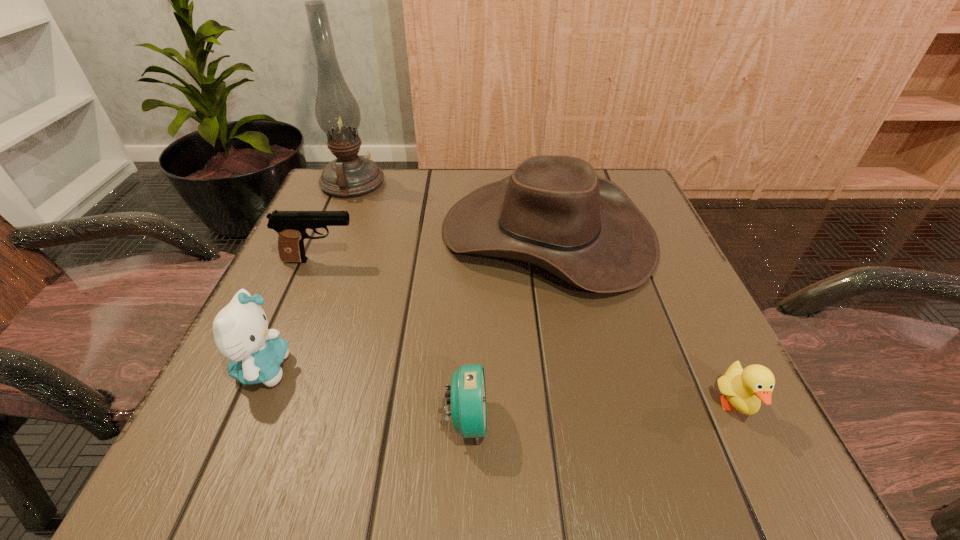
This screenshot has height=540, width=960. In order to click on free space located on the front-facing side of the alarm clock in this screenshot , I will do `click(736, 420)`.

You are a GUI agent. You are given a task and a screenshot of the screen. Output one action in this format:
    pyautogui.click(x=<x>, y=<y>)
    Task: Click on the vacant space situated 0.050m on the front-facing side of the duckling
    
    Given the screenshot: What is the action you would take?
    pyautogui.click(x=766, y=470)

Find the location of a particular element. Image resolution: width=960 pixels, height=540 pixels. oil lamp at the far edge is located at coordinates (337, 112).

The height and width of the screenshot is (540, 960). In order to click on cowboy hat situated at the far edge in this screenshot , I will do `click(553, 211)`.

The height and width of the screenshot is (540, 960). I want to click on alarm clock that is at the near edge, so click(468, 395).

Where is `duckling present at the near edge`? This screenshot has width=960, height=540. duckling present at the near edge is located at coordinates (745, 389).

I want to click on oil lamp present at the left edge, so click(x=337, y=112).

In order to click on kitten that is at the left edge in this screenshot , I will do click(x=240, y=329).

Find the location of a particular element. pistol present at the left edge is located at coordinates (291, 226).

What are the coordinates of `cowboy hat situated at the right edge` in the screenshot? It's located at (553, 211).